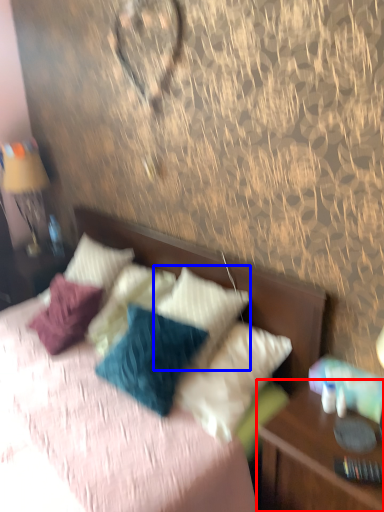
Question: Among these objects, which one is nearest to the camera, nightstand (highlighted by a red box) or pillow (highlighted by a blue box)?

Choices:
 (A) nightstand
 (B) pillow

Answer: (A)